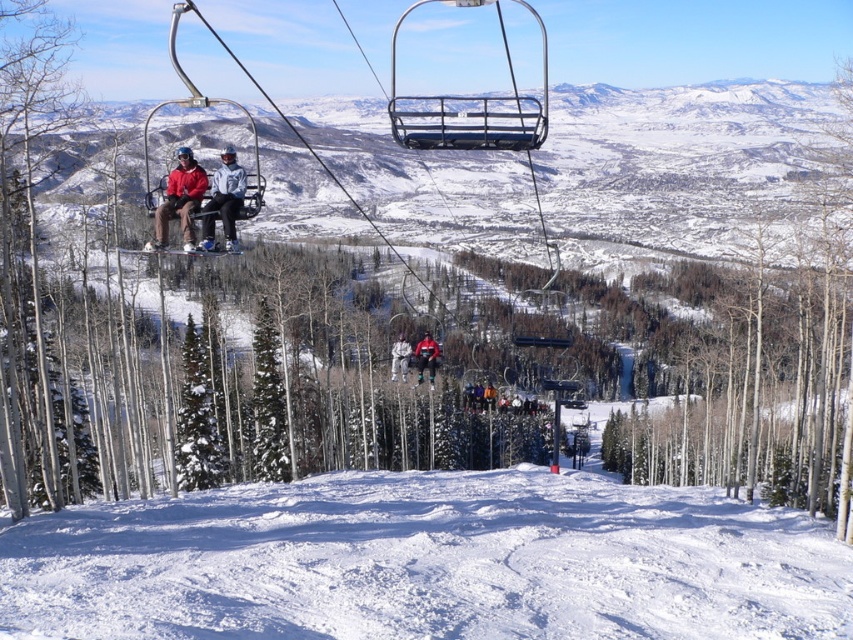
Question: Considering the real-world distances, which object is farthest from the matte red jacket at upper center?

Choices:
 (A) matte black jacket at center
 (B) metallic blue ski lift at upper center

Answer: (B)

Question: Among these objects, which one is nearest to the camera?

Choices:
 (A) white snowboard at center
 (B) matte red jacket at upper center
 (C) matte black jacket at center

Answer: (B)

Question: Is the position of white powdery snow at lower center less distant than that of matte black jacket at center?

Choices:
 (A) yes
 (B) no

Answer: (A)

Question: Which object is closer to the camera taking this photo?

Choices:
 (A) red fabric jacket at center
 (B) matte black jacket at center

Answer: (B)

Question: Can you confirm if red fabric jacket at center is positioned above white snowboard at center?

Choices:
 (A) no
 (B) yes

Answer: (A)

Question: Where is smooth white bark at center located in relation to matte red jacket at upper center in the image?

Choices:
 (A) below
 (B) above

Answer: (B)